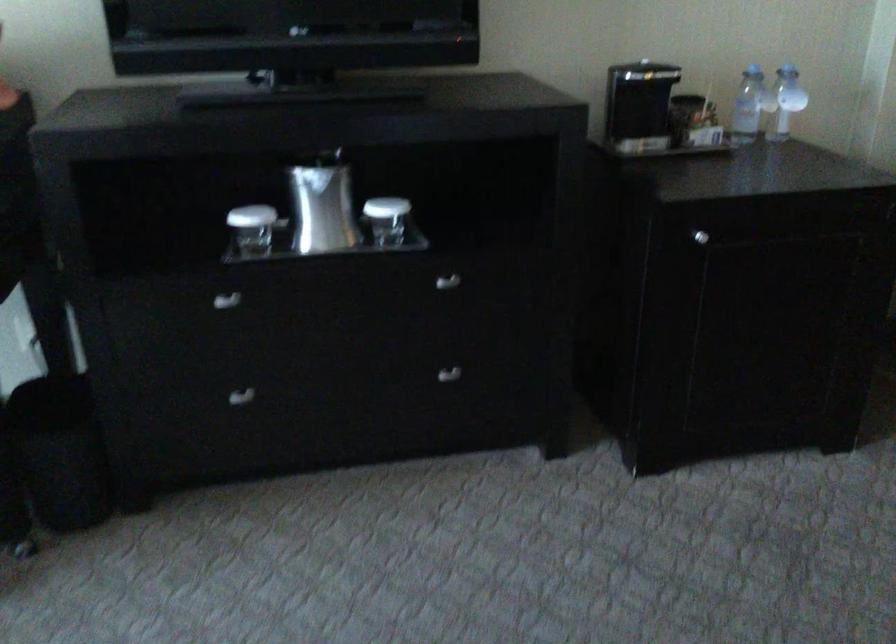
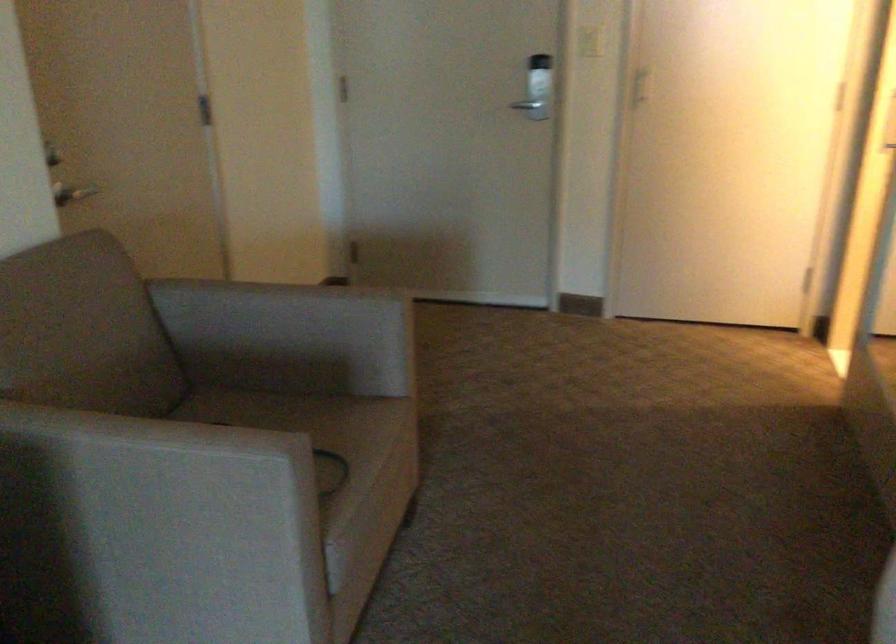
Question: The camera is either moving clockwise (left) or counter-clockwise (right) around the object. The first image is from the beginning of the video and the second image is from the end. Is the camera moving left or right when shooting the video?

Choices:
 (A) Left
 (B) Right

Answer: (A)